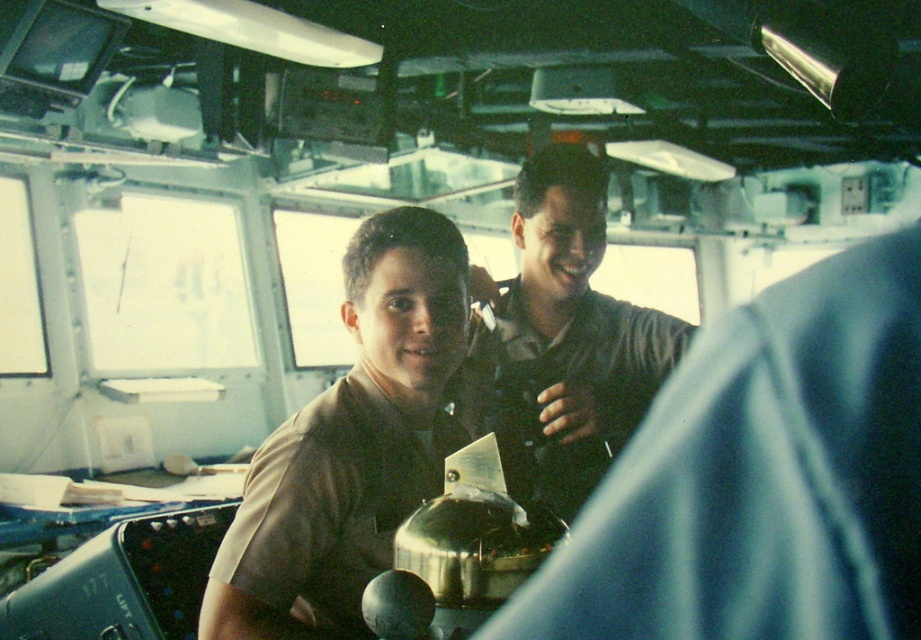
Between matte brown shirt at center and dark brown uniform at center, which one appears on the left side from the viewer's perspective?

matte brown shirt at center is more to the left.

Find the location of a particular element. This screenshot has height=640, width=921. matte brown shirt at center is located at coordinates (350, 444).

Is brown uniform at center positioned in front of dark brown uniform at center?

No, brown uniform at center is further to the viewer.

Does brown uniform at center have a larger size compared to dark brown uniform at center?

Yes, brown uniform at center is bigger than dark brown uniform at center.

Identify the location of brown uniform at center. The height and width of the screenshot is (640, 921). (563, 332).

This screenshot has width=921, height=640. I want to click on brown uniform at center, so click(563, 332).

Does brown uniform at center have a larger size compared to matte brown shirt at center?

Correct, brown uniform at center is larger in size than matte brown shirt at center.

Describe the element at coordinates (563, 332) in the screenshot. The height and width of the screenshot is (640, 921). I see `brown uniform at center` at that location.

Is point (575, 225) more distant than point (362, 321)?

Yes, it is behind point (362, 321).

Where is `brown uniform at center`? brown uniform at center is located at coordinates point(563,332).